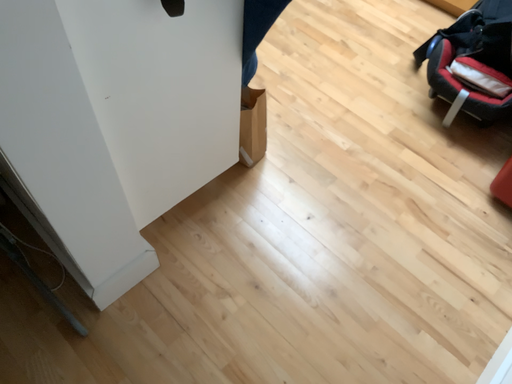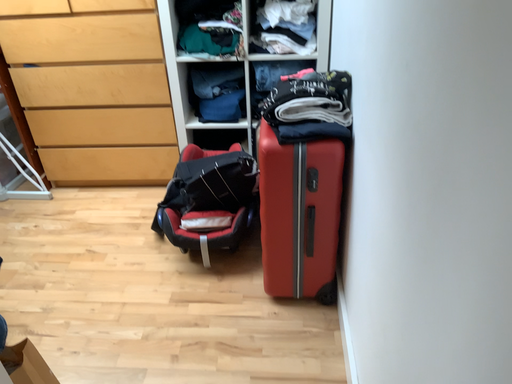
Question: Which way did the camera rotate in the video?

Choices:
 (A) rotated right
 (B) rotated left

Answer: (A)